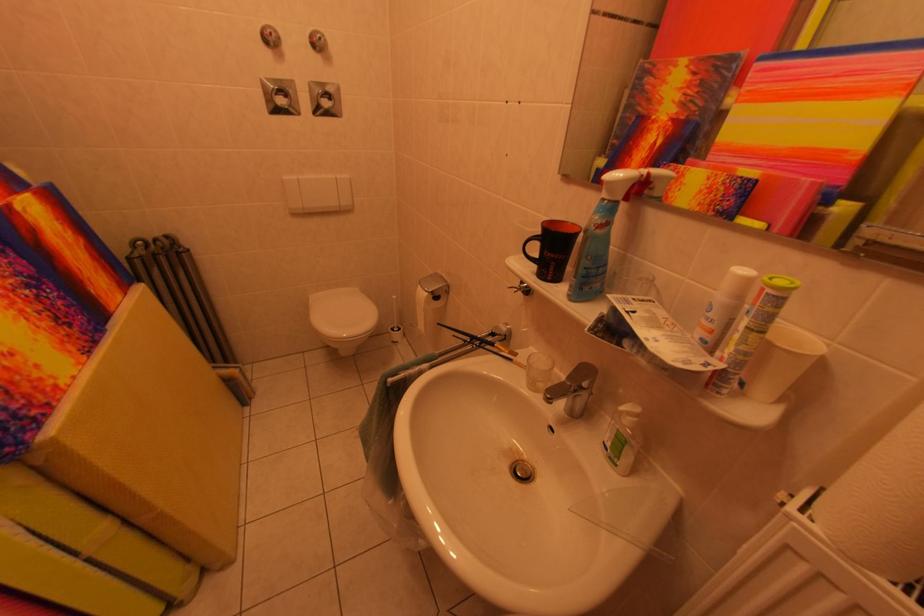
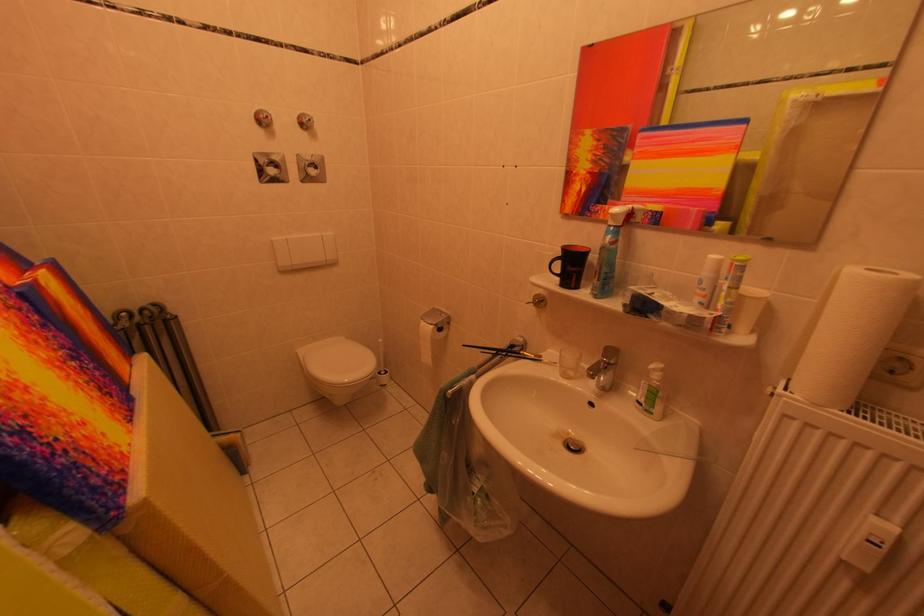
In the second image, find the point that corresponds to point (322, 301) in the first image.

(311, 355)